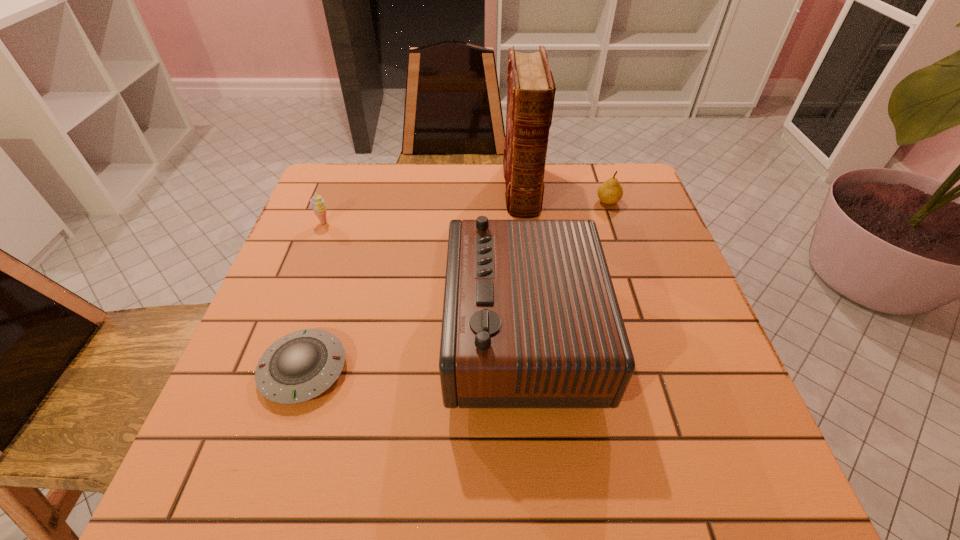
Point out which object is positioned as the third nearest to the rightmost object. Please provide its 2D coordinates. Your answer should be formatted as a tuple, i.e. [(x, y)], where the tuple contains the x and y coordinates of a point satisfying the conditions above.

[(317, 204)]

This screenshot has height=540, width=960. I want to click on free space that satisfies the following two spatial constraints: 1. on the back side of the rightmost object; 2. on the right side of the saucer, so click(357, 201).

Find the location of a particular element. The width and height of the screenshot is (960, 540). free space that satisfies the following two spatial constraints: 1. on the front side of the sherbert; 2. on the left side of the shortest object is located at coordinates (266, 369).

Where is `vacant space that satisfies the following two spatial constraints: 1. on the spine side of the hardback book; 2. on the front panel of the radio receiver`? vacant space that satisfies the following two spatial constraints: 1. on the spine side of the hardback book; 2. on the front panel of the radio receiver is located at coordinates (538, 333).

This screenshot has width=960, height=540. I want to click on free space that satisfies the following two spatial constraints: 1. on the spine side of the hardback book; 2. on the right side of the pear, so click(522, 201).